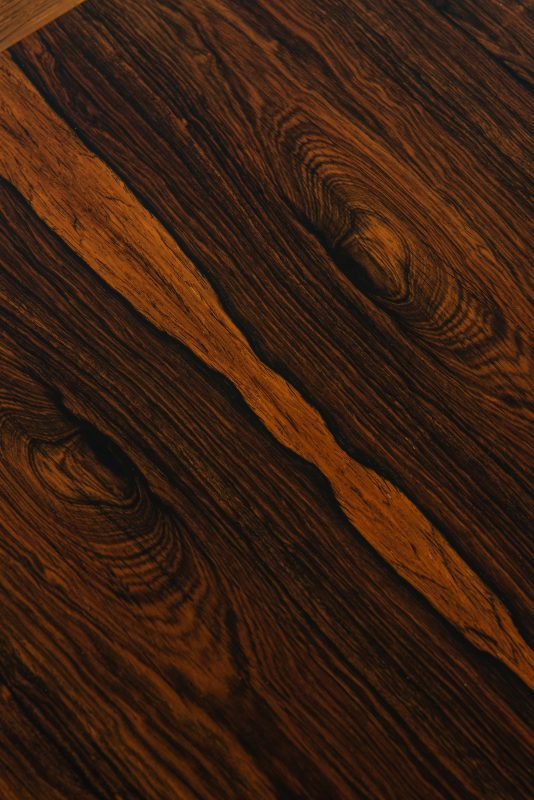
You are a GUI agent. You are given a task and a screenshot of the screen. Output one action in this format:
    pyautogui.click(x=<x>, y=<y>)
    Task: Click on the empty space on table
    
    Given the screenshot: What is the action you would take?
    pyautogui.click(x=366, y=110)